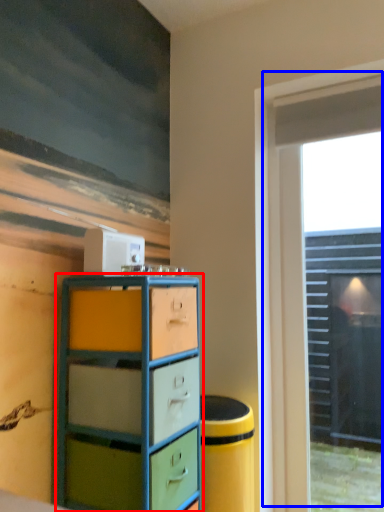
Question: Which object appears closest to the camera in this image, chest of drawers (highlighted by a red box) or window (highlighted by a blue box)?

Choices:
 (A) chest of drawers
 (B) window

Answer: (A)